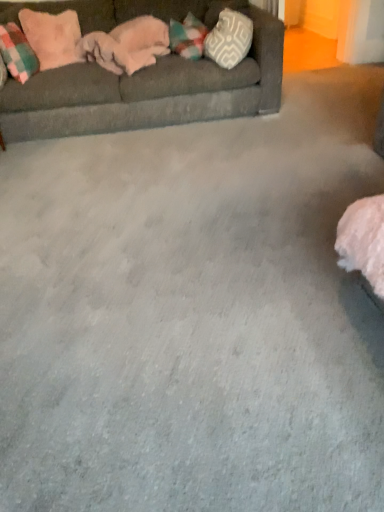
Question: Is dark gray fabric couch at upper left taller or shorter than white textured pillow at upper right, placed as the third pillow when sorted from left to right?

Choices:
 (A) tall
 (B) short

Answer: (A)

Question: From a real-world perspective, is dark gray fabric couch at upper left physically located above or below white textured pillow at upper right, which is the first pillow in right-to-left order?

Choices:
 (A) below
 (B) above

Answer: (A)

Question: Considering the real-world distances, which object is farthest from the dark gray fabric couch at upper left?

Choices:
 (A) plaid fabric pillow at left, the third pillow from the right
 (B) white textured pillow at upper right, which is the first pillow in right-to-left order
 (C) pink plush pillow at upper left, the 2th pillow when ordered from right to left

Answer: (A)

Question: Which is nearer to the pink plush pillow at upper left, which ranks as the 2th pillow in left-to-right order?

Choices:
 (A) dark gray fabric couch at upper left
 (B) plaid fabric pillow at left, which appears as the first pillow when viewed from the left
 (C) white textured pillow at upper right, placed as the third pillow when sorted from left to right

Answer: (B)